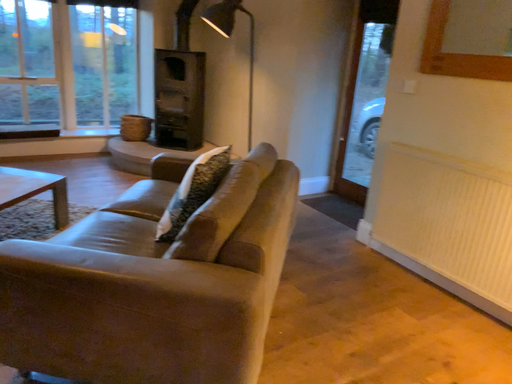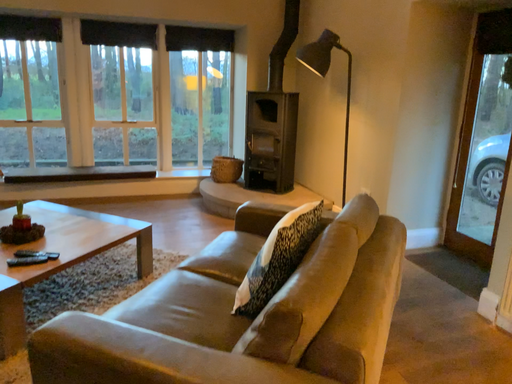
Question: Which way did the camera rotate in the video?

Choices:
 (A) rotated right
 (B) rotated left

Answer: (B)